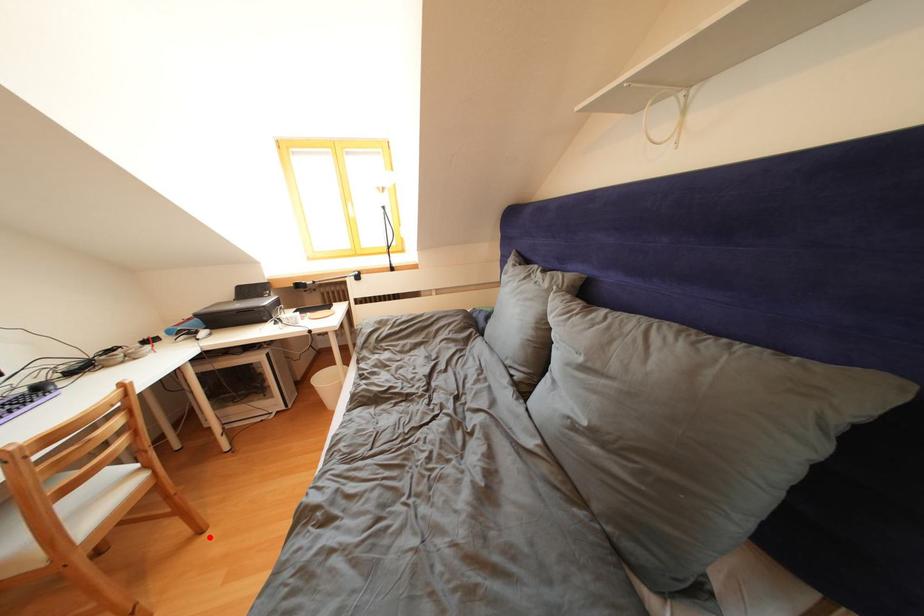
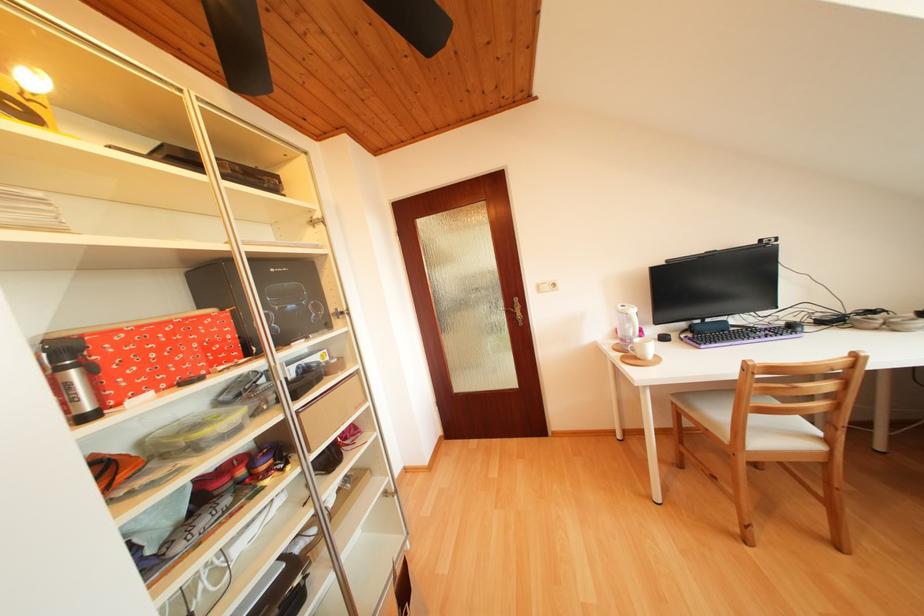
Question: I am providing you with two images of the same scene from different viewpoints. In image1, a red point is highlighted. Considering the same 3D point in image2, which of the following is correct?

Choices:
 (A) It is closer
 (B) It is farther

Answer: (B)